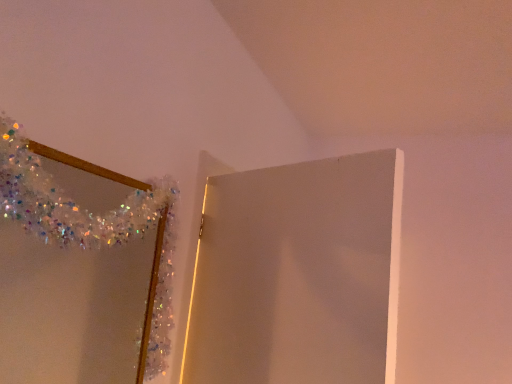
In the scene shown: Measure the distance between point (x=259, y=377) and camera.

The depth of point (x=259, y=377) is 1.27 meters.

The image size is (512, 384). In order to click on white glossy door at upper center in this screenshot , I will do `click(298, 274)`.

What do you see at coordinates (298, 274) in the screenshot?
I see `white glossy door at upper center` at bounding box center [298, 274].

The width and height of the screenshot is (512, 384). Describe the element at coordinates (74, 266) in the screenshot. I see `shiny metallic mirror at upper left` at that location.

Identify the location of shiny metallic mirror at upper left. The height and width of the screenshot is (384, 512). (74, 266).

Identify the location of white glossy door at upper center. Image resolution: width=512 pixels, height=384 pixels. (298, 274).

Can you confirm if white glossy door at upper center is positioned to the left of shiny metallic mirror at upper left?

No.

Which is in front, white glossy door at upper center or shiny metallic mirror at upper left?

Positioned in front is shiny metallic mirror at upper left.

Considering the positions of points (386, 249) and (129, 378), is point (386, 249) farther from camera compared to point (129, 378)?

No.

Looking at this image, from the image's perspective, which one is positioned higher, white glossy door at upper center or shiny metallic mirror at upper left?

shiny metallic mirror at upper left appears higher in the image.

From a real-world perspective, is white glossy door at upper center above or below shiny metallic mirror at upper left?

In terms of real-world spatial position, white glossy door at upper center is above shiny metallic mirror at upper left.

Is white glossy door at upper center thinner than shiny metallic mirror at upper left?

In fact, white glossy door at upper center might be wider than shiny metallic mirror at upper left.

Does white glossy door at upper center have a lesser height compared to shiny metallic mirror at upper left?

No.

In terms of size, does white glossy door at upper center appear bigger or smaller than shiny metallic mirror at upper left?

Clearly, white glossy door at upper center is larger in size than shiny metallic mirror at upper left.

Which is correct: white glossy door at upper center is inside shiny metallic mirror at upper left, or outside of it?

white glossy door at upper center cannot be found inside shiny metallic mirror at upper left.

Are white glossy door at upper center and shiny metallic mirror at upper left far apart?

white glossy door at upper center is near shiny metallic mirror at upper left, not far away.

Could you tell me if white glossy door at upper center is turned towards shiny metallic mirror at upper left?

Yes, white glossy door at upper center is facing shiny metallic mirror at upper left.

What's the angular difference between white glossy door at upper center and shiny metallic mirror at upper left's facing directions?

66.6 degrees separate the facing orientations of white glossy door at upper center and shiny metallic mirror at upper left.

How distant is white glossy door at upper center from shiny metallic mirror at upper left?

The distance of white glossy door at upper center from shiny metallic mirror at upper left is 15.95 inches.

At what (x,y) coordinates should I click in order to perform the action: click on door behind the shiny metallic mirror at upper left. Please return your answer as a coordinate pair (x, y). This screenshot has width=512, height=384. Looking at the image, I should click on (298, 274).

Would you say shiny metallic mirror at upper left is to the left or to the right of white glossy door at upper center in the picture?

Clearly, shiny metallic mirror at upper left is on the left of white glossy door at upper center in the image.

Does shiny metallic mirror at upper left lie in front of white glossy door at upper center?

Yes, it is.

Is point (64, 225) closer or farther from the camera than point (314, 380)?

Clearly, point (64, 225) is closer to the camera than point (314, 380).

In the scene shown: From the image's perspective, which object appears higher, shiny metallic mirror at upper left or white glossy door at upper center?

shiny metallic mirror at upper left, from the image's perspective.

Consider the image. From a real-world perspective, which object stands above the other?

white glossy door at upper center is physically above.

Considering the sizes of objects shiny metallic mirror at upper left and white glossy door at upper center in the image provided, who is wider, shiny metallic mirror at upper left or white glossy door at upper center?

Wider between the two is white glossy door at upper center.

Based on the photo, who is taller, shiny metallic mirror at upper left or white glossy door at upper center?

Standing taller between the two is white glossy door at upper center.

Does shiny metallic mirror at upper left have a larger size compared to white glossy door at upper center?

Actually, shiny metallic mirror at upper left might be smaller than white glossy door at upper center.

Looking at this image, could white glossy door at upper center be considered to be inside shiny metallic mirror at upper left?

That's incorrect, white glossy door at upper center is not inside shiny metallic mirror at upper left.

Would you consider shiny metallic mirror at upper left to be distant from white glossy door at upper center?

Actually, shiny metallic mirror at upper left and white glossy door at upper center are a little close together.

Could you tell me if shiny metallic mirror at upper left is turned towards white glossy door at upper center?

Yes, shiny metallic mirror at upper left is oriented towards white glossy door at upper center.

Can you tell me how much shiny metallic mirror at upper left and white glossy door at upper center differ in facing direction?

There is a 66.6-degree angle between the facing directions of shiny metallic mirror at upper left and white glossy door at upper center.

Measure the distance between shiny metallic mirror at upper left and white glossy door at upper center.

shiny metallic mirror at upper left is 40.51 centimeters from white glossy door at upper center.

The image size is (512, 384). I want to click on door located below the shiny metallic mirror at upper left (from the image's perspective), so click(298, 274).

Find the location of `mirror that is under the white glossy door at upper center (from a real-world perspective)`. mirror that is under the white glossy door at upper center (from a real-world perspective) is located at coordinates (74, 266).

Identify the location of mirror above the white glossy door at upper center (from the image's perspective). (74, 266).